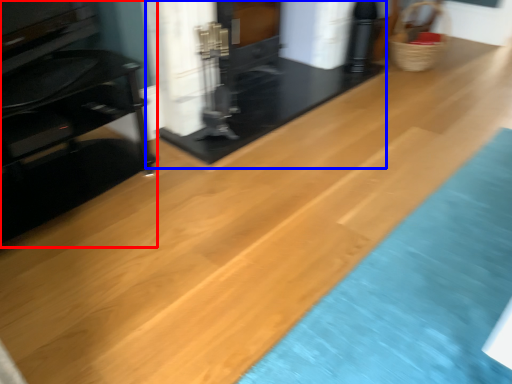
Question: Which object appears farthest to the camera in this image, furniture (highlighted by a red box) or fireplace (highlighted by a blue box)?

Choices:
 (A) furniture
 (B) fireplace

Answer: (B)